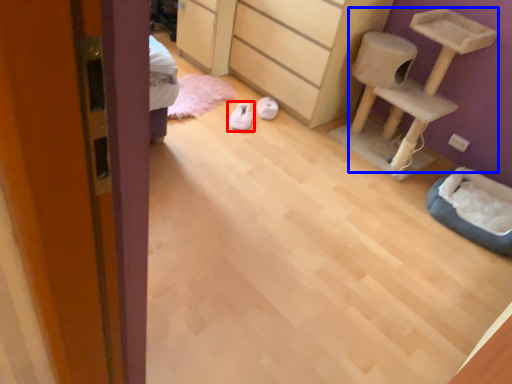
Question: Which point is closer to the camera, footwear (highlighted by a red box) or furniture (highlighted by a blue box)?

Choices:
 (A) footwear
 (B) furniture

Answer: (B)